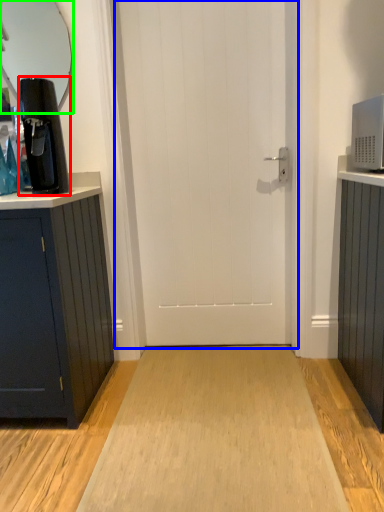
Question: Estimate the real-world distances between objects in this image. Which object is farther from coffee machine (highlighted by a red box), door (highlighted by a blue box) or mirror (highlighted by a green box)?

Choices:
 (A) door
 (B) mirror

Answer: (B)